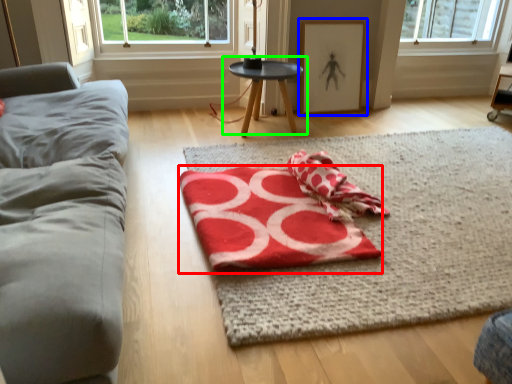
Question: Estimate the real-world distances between objects in this image. Which object is farther from beach towel (highlighted by a red box), picture frame (highlighted by a blue box) or table (highlighted by a green box)?

Choices:
 (A) picture frame
 (B) table

Answer: (A)